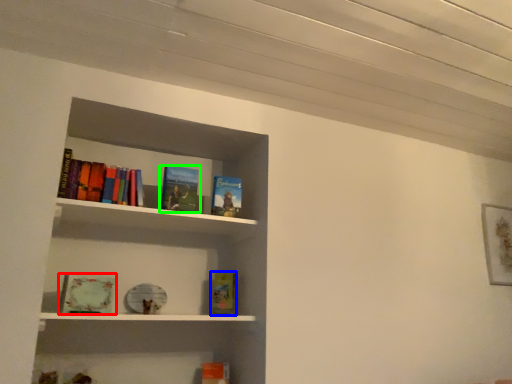
Question: Estimate the real-world distances between objects in this image. Which object is farther from book (highlighted by a red box), book (highlighted by a blue box) or book (highlighted by a green box)?

Choices:
 (A) book
 (B) book

Answer: (A)